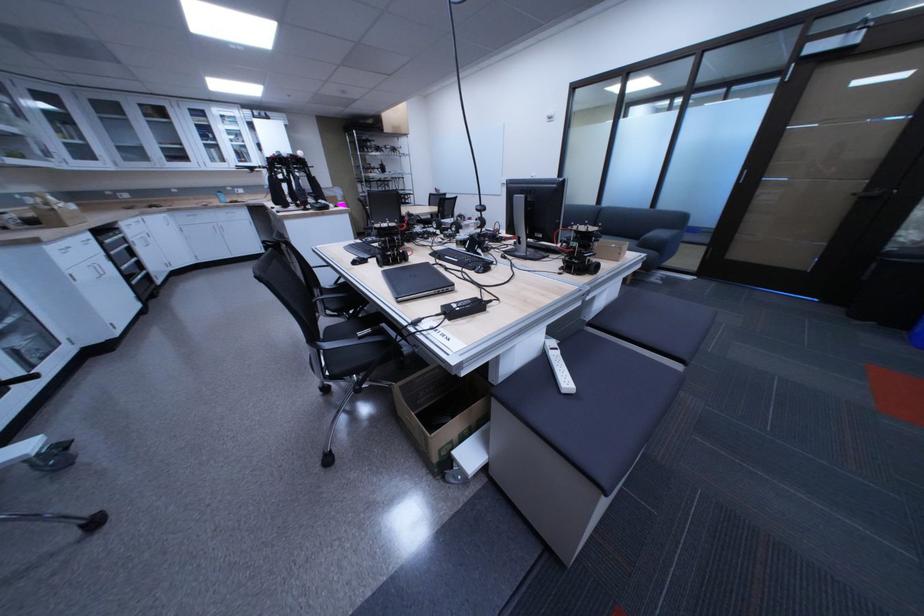
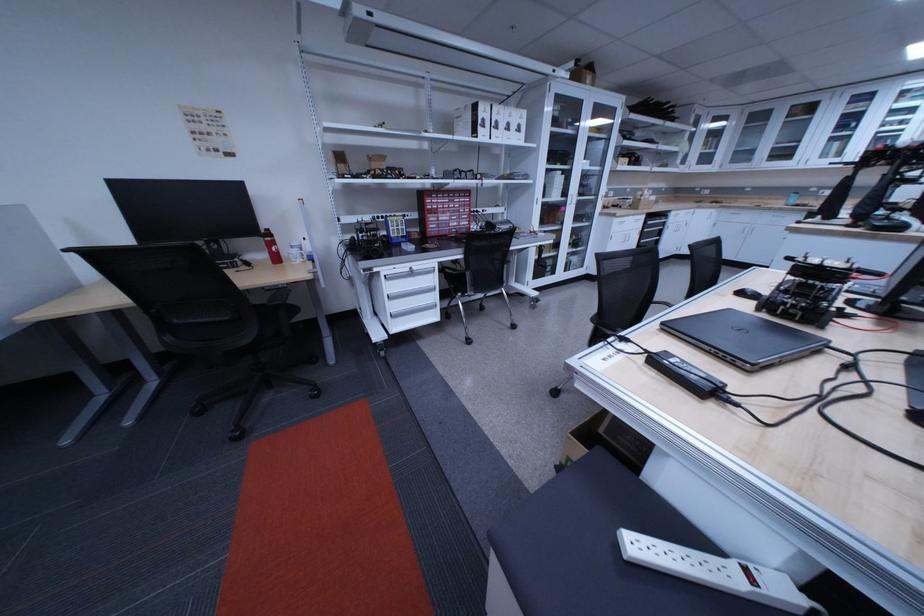
Locate, in the second image, the point that corresponds to point 236,217 in the first image.

(779, 220)